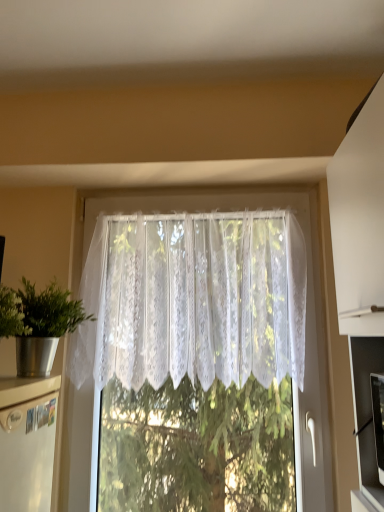
Question: Considering the positions of white lace curtain at center and metallic silver pot at left in the image, is white lace curtain at center bigger or smaller than metallic silver pot at left?

Choices:
 (A) big
 (B) small

Answer: (A)

Question: From the image's perspective, is white lace curtain at center positioned above or below metallic silver pot at left?

Choices:
 (A) above
 (B) below

Answer: (A)

Question: Based on their positions, is white lace curtain at center located to the left or right of metallic silver pot at left?

Choices:
 (A) right
 (B) left

Answer: (A)

Question: Would you say metallic silver pot at left is inside or outside white lace curtain at center?

Choices:
 (A) outside
 (B) inside

Answer: (A)

Question: Does point (39, 356) appear closer or farther from the camera than point (251, 312)?

Choices:
 (A) closer
 (B) farther

Answer: (A)

Question: Would you say metallic silver pot at left is to the left or to the right of white lace curtain at center in the picture?

Choices:
 (A) right
 (B) left

Answer: (B)

Question: From the image's perspective, is metallic silver pot at left above or below white lace curtain at center?

Choices:
 (A) above
 (B) below

Answer: (B)